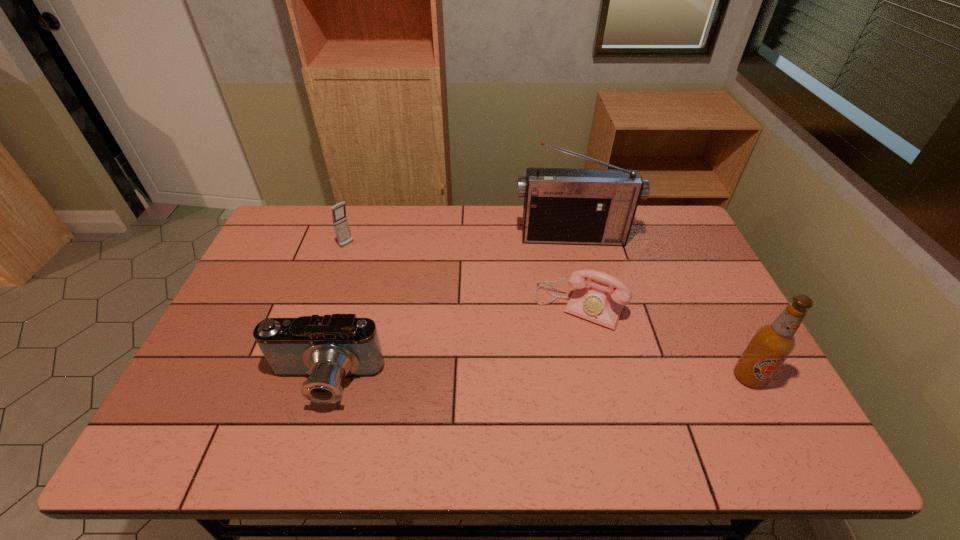
Where is `vacant space that's between the second tallest object and the shortest object`? This screenshot has width=960, height=540. vacant space that's between the second tallest object and the shortest object is located at coordinates (664, 341).

Locate an element on the screen. This screenshot has width=960, height=540. blank region between the beer bottle and the third farthest object is located at coordinates (664, 341).

Identify the location of free spot between the fourth shortest object and the radio receiver. The image size is (960, 540). (660, 307).

This screenshot has width=960, height=540. I want to click on vacant area between the third nearest object and the cellular telephone, so click(x=464, y=275).

At what (x,y) coordinates should I click in order to perform the action: click on free space between the camcorder and the cellular telephone. Please return your answer as a coordinate pair (x, y). The width and height of the screenshot is (960, 540). Looking at the image, I should click on (336, 313).

Locate an element on the screen. The image size is (960, 540). vacant area that lies between the beer bottle and the tallest object is located at coordinates (660, 307).

You are a GUI agent. You are given a task and a screenshot of the screen. Output one action in this format:
    pyautogui.click(x=<x>, y=<y>)
    Task: Click on the free space between the cellular telephone and the shortest object
    The height and width of the screenshot is (540, 960).
    Given the screenshot: What is the action you would take?
    pyautogui.click(x=464, y=275)

At what (x,y) coordinates should I click in order to perform the action: click on object that can be found as the second closest to the cellular telephone. Please return your answer as a coordinate pair (x, y). Looking at the image, I should click on (571, 206).

I want to click on the third closest object to the beer bottle, so click(326, 349).

At what (x,y) coordinates should I click in order to perform the action: click on free space that satisfies the following two spatial constraints: 1. on the front side of the third farthest object; 2. on the right side of the cellular telephone. Please return your answer as a coordinate pair (x, y). The height and width of the screenshot is (540, 960). Looking at the image, I should click on (326, 306).